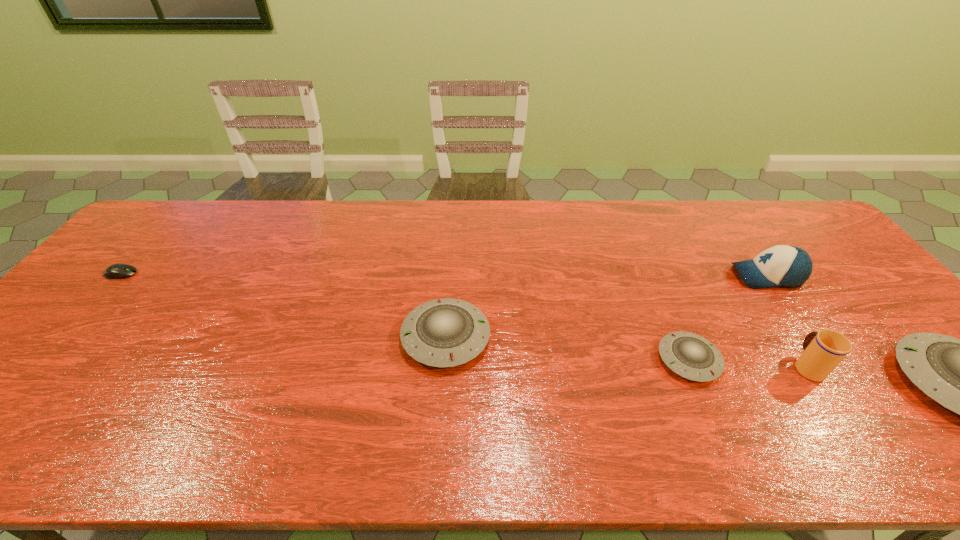
Image resolution: width=960 pixels, height=540 pixels. I want to click on vacant area situated 0.050m on the front-facing side of the baseball cap, so click(x=715, y=276).

Locate an element on the screen. The width and height of the screenshot is (960, 540). vacant space located 0.330m on the front-facing side of the baseball cap is located at coordinates (619, 276).

Find the location of a particular element. This screenshot has width=960, height=540. vacant area located 0.360m on the front-facing side of the baseball cap is located at coordinates (609, 276).

Image resolution: width=960 pixels, height=540 pixels. Identify the location of free space located on the wheel side of the computer mouse. point(184,274).

Where is `free space located on the side of the cup with the handle`? free space located on the side of the cup with the handle is located at coordinates (745, 271).

Locate an element on the screen. The width and height of the screenshot is (960, 540). vacant area situated 0.380m on the side of the cup with the handle is located at coordinates (732, 252).

Locate an element on the screen. The width and height of the screenshot is (960, 540). vacant space located 0.370m on the side of the cup with the handle is located at coordinates (733, 254).

Locate an element on the screen. The height and width of the screenshot is (540, 960). saucer present at the near edge is located at coordinates (689, 355).

The height and width of the screenshot is (540, 960). What are the coordinates of `cup that is at the near edge` in the screenshot? It's located at (823, 351).

I want to click on object that is at the left edge, so point(116,271).